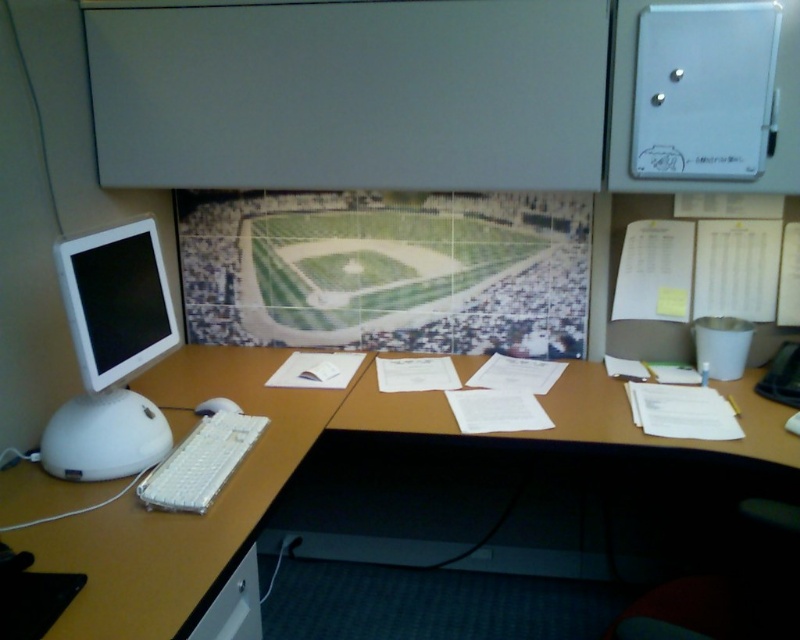
Question: Estimate the real-world distances between objects in this image. Which object is farther from the white plastic mouse at lower left?

Choices:
 (A) white plastic keyboard at lower left
 (B) white plastic computer desk at center

Answer: (B)

Question: Can you confirm if white glossy monitor at left is bigger than white plastic mouse at lower left?

Choices:
 (A) no
 (B) yes

Answer: (B)

Question: Is the position of white glossy monitor at left less distant than that of white plastic keyboard at lower left?

Choices:
 (A) no
 (B) yes

Answer: (B)

Question: Does white plastic computer desk at center have a larger size compared to white plastic keyboard at lower left?

Choices:
 (A) no
 (B) yes

Answer: (B)

Question: Which of these objects is positioned closest to the white glossy monitor at left?

Choices:
 (A) white plastic mouse at lower left
 (B) white plastic keyboard at lower left

Answer: (B)

Question: Which of the following is the farthest from the observer?

Choices:
 (A) white plastic keyboard at lower left
 (B) white plastic computer desk at center
 (C) white glossy monitor at left

Answer: (A)